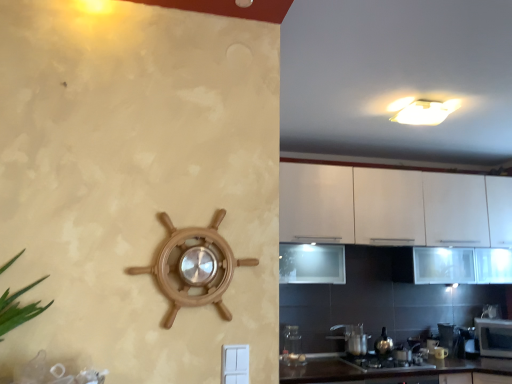
Question: From a real-world perspective, is black glossy countertop at lower center located beneath metallic silver toaster at lower right, which is the fifth appliance in front-to-back order?

Choices:
 (A) yes
 (B) no

Answer: (A)

Question: Does black glossy countertop at lower center have a larger size compared to metallic silver toaster at lower right, the second appliance when ordered from back to front?

Choices:
 (A) no
 (B) yes

Answer: (B)

Question: Is black glossy countertop at lower center to the right of metallic silver toaster at lower right, the second appliance when ordered from back to front, from the viewer's perspective?

Choices:
 (A) no
 (B) yes

Answer: (A)

Question: Does black glossy countertop at lower center have a smaller size compared to metallic silver toaster at lower right, the 5th appliance from the top?

Choices:
 (A) yes
 (B) no

Answer: (B)

Question: Considering the relative positions of black glossy countertop at lower center and metallic silver toaster at lower right, the second appliance when ordered from back to front, in the image provided, is black glossy countertop at lower center to the left of metallic silver toaster at lower right, the second appliance when ordered from back to front, from the viewer's perspective?

Choices:
 (A) no
 (B) yes

Answer: (B)

Question: From the image's perspective, is metallic silver gas stove at lower center positioned above or below satin silver kettle at lower center, which appears as the fourth appliance when ordered from the bottom?

Choices:
 (A) above
 (B) below

Answer: (B)

Question: Looking at their shapes, would you say metallic silver gas stove at lower center is wider or thinner than satin silver kettle at lower center, which is counted as the fourth appliance, starting from the back?

Choices:
 (A) thin
 (B) wide

Answer: (B)

Question: Relative to satin silver kettle at lower center, positioned as the 3th appliance in left-to-right order, is metallic silver gas stove at lower center in front or behind?

Choices:
 (A) front
 (B) behind

Answer: (A)

Question: Visually, is metallic silver gas stove at lower center positioned to the left or to the right of satin silver kettle at lower center, the fourth appliance viewed from the right?

Choices:
 (A) left
 (B) right

Answer: (B)

Question: From the image's perspective, is metallic silver toaster at lower right, the sixth appliance when ordered from left to right, above or below transparent glass jar at lower center, which is the second appliance from top to bottom?

Choices:
 (A) below
 (B) above

Answer: (A)

Question: Considering the positions of point (451, 342) and point (287, 327), is point (451, 342) closer or farther from the camera than point (287, 327)?

Choices:
 (A) farther
 (B) closer

Answer: (A)

Question: Would you say metallic silver toaster at lower right, the second appliance when ordered from back to front, is to the left or to the right of transparent glass jar at lower center, the second appliance in the front-to-back sequence, in the picture?

Choices:
 (A) right
 (B) left

Answer: (A)

Question: Based on their sizes in the image, would you say metallic silver toaster at lower right, marked as the first appliance in a right-to-left arrangement, is bigger or smaller than transparent glass jar at lower center, the second appliance in the front-to-back sequence?

Choices:
 (A) small
 (B) big

Answer: (A)

Question: Considering the positions of point (286, 377) and point (289, 342), is point (286, 377) closer or farther from the camera than point (289, 342)?

Choices:
 (A) closer
 (B) farther

Answer: (A)

Question: From a real-world perspective, is black glossy countertop at lower center physically located above or below transparent glass jar at lower center, which is the second appliance from top to bottom?

Choices:
 (A) below
 (B) above

Answer: (A)